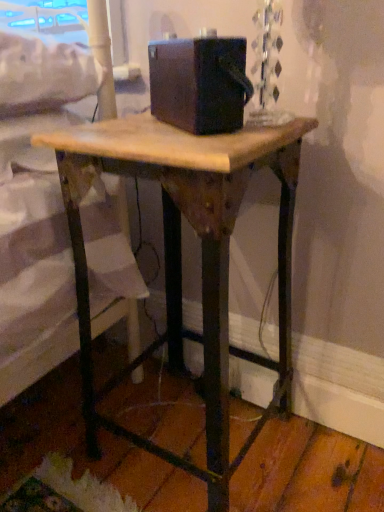
Locate an element on the screen. vacant region to the left of matte black box at center is located at coordinates (124, 125).